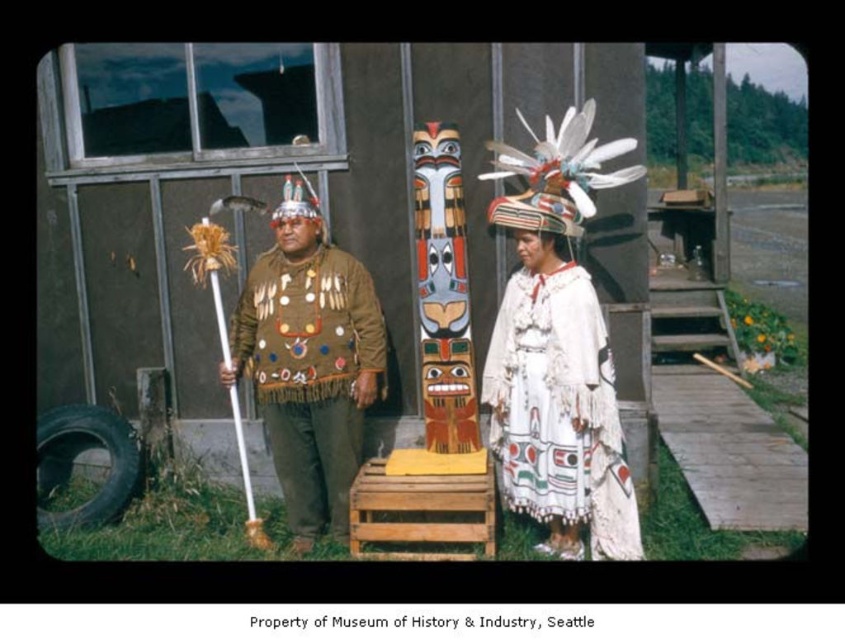
You are an anthropologist examining the image of two individuals in traditional attire. You notice the white fringed dress at center and the brown leather jacket at center. Which of these items is located below the other?

The white fringed dress at center is positioned under the brown leather jacket at center, so the white fringed dress is below the brown leather jacket.

You are a photographer planning to capture a photo of the white fringed dress at center and the polychrome carved totem pole at center. If you want to ensure both subjects are fully visible in the frame, which one should you focus on first to avoid cropping either?

The white fringed dress at center is shorter than the polychrome carved totem pole at center. Therefore, you should focus on the polychrome carved totem pole at center first since it is taller and requires more vertical space to fit entirely in the frame.

You are a photographer trying to capture the white fringed dress at center and the polychrome carved totem pole at center in a single shot. Can you see both objects clearly in the frame?

The white fringed dress at center is in front of the polychrome carved totem pole at center, so the dress may block part of the totem pole in the photo. Adjust your angle or position to ensure both are visible.